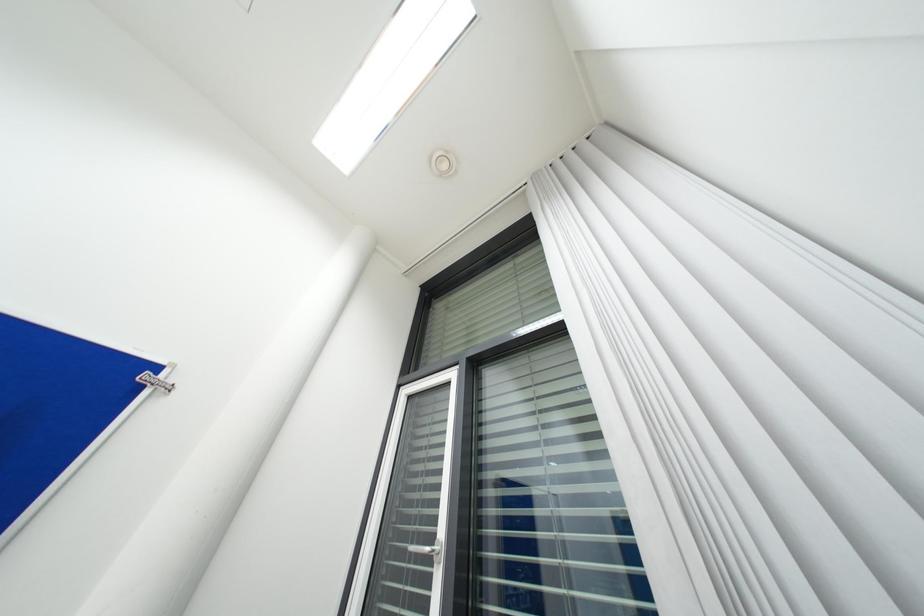
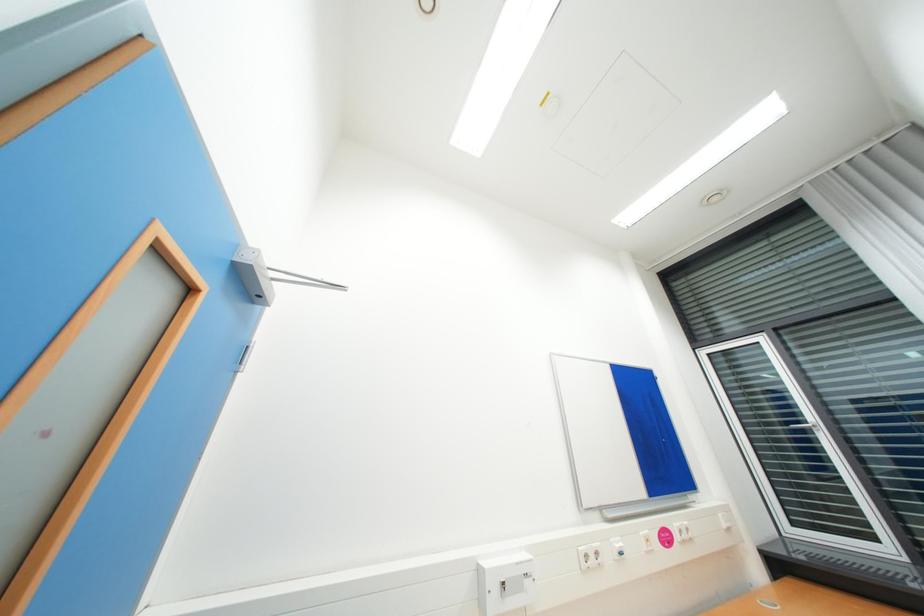
The images are taken continuously from a first-person perspective. In which direction are you moving?

The cameraman moved toward left, backward.